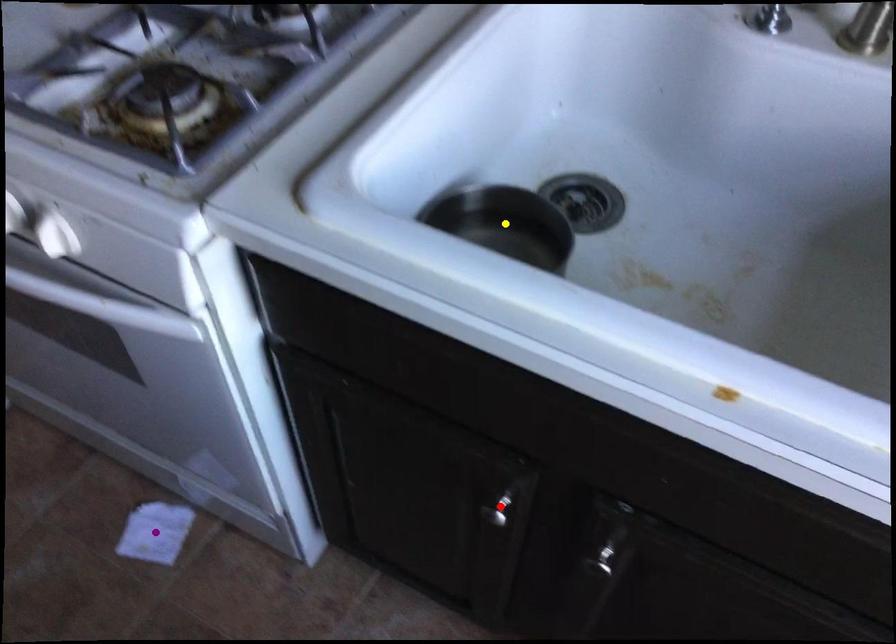
Order these from nearest to farthest:
A) purple point
B) yellow point
C) red point

purple point
yellow point
red point